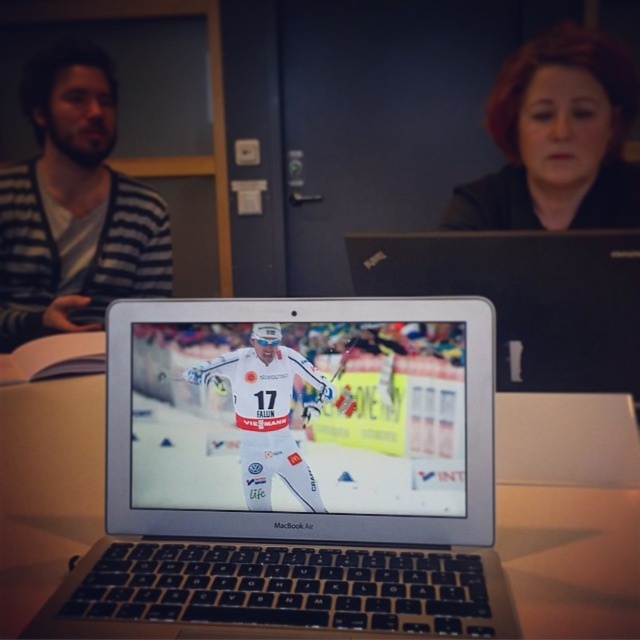
Which is more to the right, striped sweater at left or smooth black hair at upper right?

Positioned to the right is smooth black hair at upper right.

From the picture: Who is more distant from viewer, [49,282] or [490,124]?

The point [490,124] is more distant.

Image resolution: width=640 pixels, height=640 pixels. Identify the location of striped sweater at left. (74, 205).

Which of these two, silver metallic laptop at center or smooth black hair at upper right, stands shorter?

Standing shorter between the two is silver metallic laptop at center.

Which is more to the left, silver metallic laptop at center or smooth black hair at upper right?

From the viewer's perspective, silver metallic laptop at center appears more on the left side.

Find the location of a particular element. Image resolution: width=640 pixels, height=640 pixels. silver metallic laptop at center is located at coordinates (292, 476).

Which is more to the left, silver metallic laptop at center or striped sweater at left?

striped sweater at left

Between point (404, 570) and point (48, 76), which one is positioned behind?

The point (48, 76) is behind.

This screenshot has height=640, width=640. Find the location of `silver metallic laptop at center`. silver metallic laptop at center is located at coordinates (292, 476).